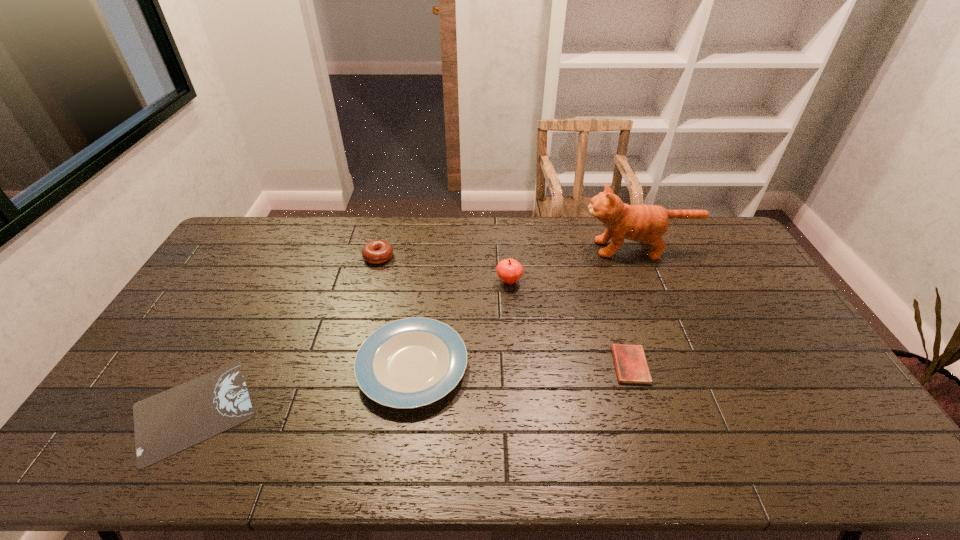
This screenshot has height=540, width=960. In order to click on object that is at the right edge in this screenshot , I will do `click(647, 223)`.

Where is `object located at the near left corner`? This screenshot has height=540, width=960. object located at the near left corner is located at coordinates (169, 422).

Locate an element on the screen. The width and height of the screenshot is (960, 540). object positioned at the far right corner is located at coordinates 647,223.

Find the location of a particular element. vacant area at the far edge of the desktop is located at coordinates (444, 227).

Image resolution: width=960 pixels, height=540 pixels. What are the coordinates of `free space at the near edge of the desktop` in the screenshot? It's located at (597, 456).

Where is `vacant space at the left edge of the desktop`? The height and width of the screenshot is (540, 960). vacant space at the left edge of the desktop is located at coordinates (111, 421).

The height and width of the screenshot is (540, 960). I want to click on vacant space at the right edge of the desktop, so click(x=778, y=382).

This screenshot has height=540, width=960. In the image, there is a desktop. What are the coordinates of `free region at the far left corner` in the screenshot? It's located at (237, 234).

At what (x,y) coordinates should I click in order to perform the action: click on empty location between the plate and the fourth object from left to right. Please return your answer as a coordinate pair (x, y). The height and width of the screenshot is (540, 960). Looking at the image, I should click on (461, 324).

Identify the location of free space between the doughnut and the mousepad. This screenshot has width=960, height=540. (286, 334).